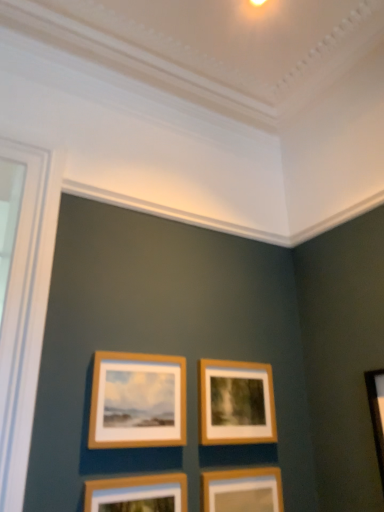
Question: Is wooden frame at center, which is the third picture frame from bottom to top, looking in the opposite direction of wooden picture frame at lower center, which is counted as the 1th picture frame, starting from the bottom?

Choices:
 (A) no
 (B) yes

Answer: (A)

Question: Does wooden frame at center, which is the third picture frame from bottom to top, have a greater width compared to wooden picture frame at lower center, which is the 4th picture frame from top to bottom?

Choices:
 (A) no
 (B) yes

Answer: (B)

Question: Is wooden frame at center, which is the third picture frame from bottom to top, directly adjacent to wooden picture frame at lower center, which is the 4th picture frame from top to bottom?

Choices:
 (A) no
 (B) yes

Answer: (A)

Question: From a real-world perspective, is wooden frame at center, the second picture frame from the top, on wooden picture frame at lower center, which is the 4th picture frame from top to bottom?

Choices:
 (A) yes
 (B) no

Answer: (A)

Question: Is wooden frame at center, the second picture frame from the top, further to camera compared to wooden picture frame at lower center, which is the 4th picture frame from top to bottom?

Choices:
 (A) yes
 (B) no

Answer: (A)

Question: Considering the positions of wooden frame at center, placed as the fourth picture frame when sorted from bottom to top, and wooden picture frame at lower center, which ranks as the 2th picture frame in bottom-to-top order, in the image, is wooden frame at center, placed as the fourth picture frame when sorted from bottom to top, wider or thinner than wooden picture frame at lower center, which ranks as the 2th picture frame in bottom-to-top order,?

Choices:
 (A) thin
 (B) wide

Answer: (A)

Question: Relative to wooden picture frame at lower center, which ranks as the 2th picture frame in bottom-to-top order, is wooden frame at center, which ranks as the first picture frame in top-to-bottom order, in front or behind?

Choices:
 (A) front
 (B) behind

Answer: (B)

Question: From a real-world perspective, is wooden frame at center, placed as the fourth picture frame when sorted from bottom to top, positioned above or below wooden picture frame at lower center, which ranks as the 2th picture frame in bottom-to-top order?

Choices:
 (A) above
 (B) below

Answer: (A)

Question: From their relative heights in the image, would you say wooden frame at center, which ranks as the first picture frame in top-to-bottom order, is taller or shorter than wooden picture frame at lower center, which ranks as the 2th picture frame in bottom-to-top order?

Choices:
 (A) tall
 (B) short

Answer: (A)

Question: Considering the positions of wooden picture frame at lower center, which is counted as the 1th picture frame, starting from the bottom, and wooden frame at center, which is the third picture frame from bottom to top, in the image, is wooden picture frame at lower center, which is counted as the 1th picture frame, starting from the bottom, taller or shorter than wooden frame at center, which is the third picture frame from bottom to top,?

Choices:
 (A) short
 (B) tall

Answer: (B)

Question: In the image, is wooden picture frame at lower center, which is the 4th picture frame from top to bottom, on the left side or the right side of wooden frame at center, the second picture frame from the top?

Choices:
 (A) right
 (B) left

Answer: (A)

Question: Is wooden picture frame at lower center, which is the 4th picture frame from top to bottom, bigger or smaller than wooden frame at center, the second picture frame from the top?

Choices:
 (A) small
 (B) big

Answer: (B)

Question: From the image's perspective, is wooden picture frame at lower center, which is the 4th picture frame from top to bottom, positioned above or below wooden frame at center, the second picture frame from the top?

Choices:
 (A) below
 (B) above

Answer: (A)

Question: Based on their sizes in the image, would you say wooden picture frame at lower center, which ranks as the 2th picture frame in bottom-to-top order, is bigger or smaller than wooden frame at center, which is the third picture frame from bottom to top?

Choices:
 (A) small
 (B) big

Answer: (B)

Question: From a real-world perspective, is wooden picture frame at lower center, which ranks as the 2th picture frame in bottom-to-top order, above or below wooden frame at center, the second picture frame from the top?

Choices:
 (A) above
 (B) below

Answer: (B)